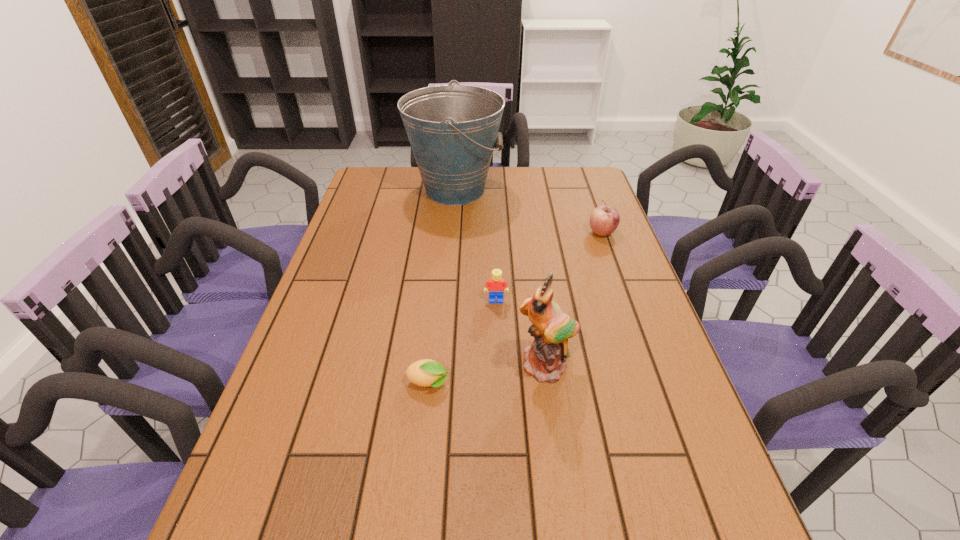
At what (x,y) coordinates should I click in order to perform the action: click on free space between the rightmost object and the farthest object. Please return your answer as a coordinate pair (x, y). The height and width of the screenshot is (540, 960). Looking at the image, I should click on (528, 212).

You are a GUI agent. You are given a task and a screenshot of the screen. Output one action in this format:
    pyautogui.click(x=<x>, y=<y>)
    Task: Click on the free space between the shortest object and the bucket
    This screenshot has height=540, width=960.
    Given the screenshot: What is the action you would take?
    pyautogui.click(x=442, y=287)

What are the coordinates of `vacant region between the bucket and the second farthest object` in the screenshot? It's located at (528, 212).

Where is `free spot between the shortest object and the Lego`? The width and height of the screenshot is (960, 540). free spot between the shortest object and the Lego is located at coordinates (463, 342).

Locate an element on the screen. unoccupied position between the fourth nearest object and the lemon is located at coordinates (516, 308).

You are a GUI agent. You are given a task and a screenshot of the screen. Output one action in this format:
    pyautogui.click(x=<x>, y=<y>)
    Task: Click on the free space between the parrot and the shortest object
    The image size is (960, 540).
    Given the screenshot: What is the action you would take?
    pyautogui.click(x=488, y=375)

Locate an element on the screen. The width and height of the screenshot is (960, 540). object that can be found as the second closest to the lemon is located at coordinates (497, 286).

Choose which object is the third nearest neighbor to the shortest object. Please provide its 2D coordinates. Your answer should be formatted as a tuple, i.e. [(x, y)], where the tuple contains the x and y coordinates of a point satisfying the conditions above.

[(453, 129)]

Find the location of `vacant region that satisfies the following two spatial constraints: 1. with the handle on opposite sides of the farthest object; 2. on the left side of the rightmost object`. vacant region that satisfies the following two spatial constraints: 1. with the handle on opposite sides of the farthest object; 2. on the left side of the rightmost object is located at coordinates (451, 233).